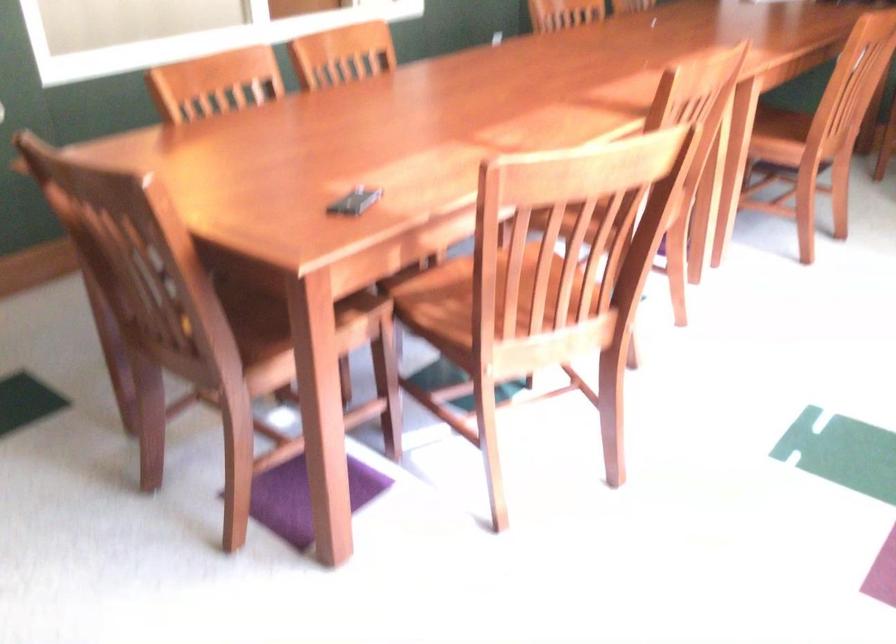
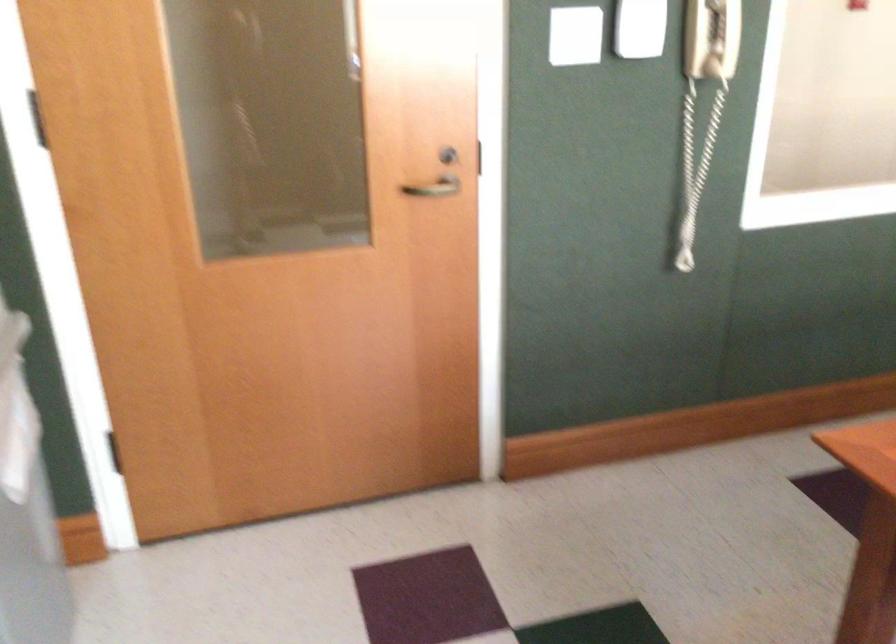
Question: The images are taken continuously from a first-person perspective. In which direction is your viewpoint rotating?

Choices:
 (A) Left
 (B) Right
 (C) Up
 (D) Down

Answer: (A)